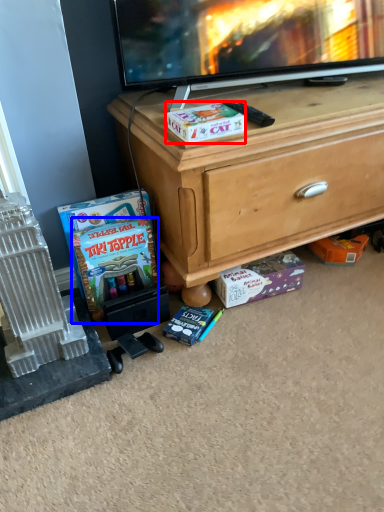
Question: Which point is closer to the camera, box (highlighted by a red box) or comic book (highlighted by a blue box)?

Choices:
 (A) box
 (B) comic book

Answer: (A)